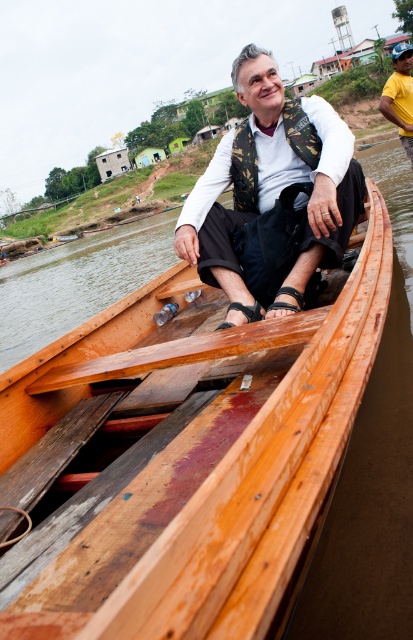
Question: Among these objects, which one is nearest to the camera?

Choices:
 (A) yellow cotton shirt at right
 (B) camouflage fabric vest at center
 (C) wooden paddle at center

Answer: (C)

Question: Is wooden boat at center above camouflage fabric vest at center?

Choices:
 (A) yes
 (B) no

Answer: (B)

Question: Is camouflage fabric vest at center above wooden paddle at center?

Choices:
 (A) yes
 (B) no

Answer: (A)

Question: Estimate the real-world distances between objects in this image. Which object is closer to the wooden paddle at center?

Choices:
 (A) wooden boat at center
 (B) yellow cotton shirt at right

Answer: (A)

Question: Which point appears farthest from the camera in this image?

Choices:
 (A) (299, 480)
 (B) (99, 376)

Answer: (B)

Question: Is camouflage fabric vest at center in front of wooden paddle at center?

Choices:
 (A) no
 (B) yes

Answer: (A)